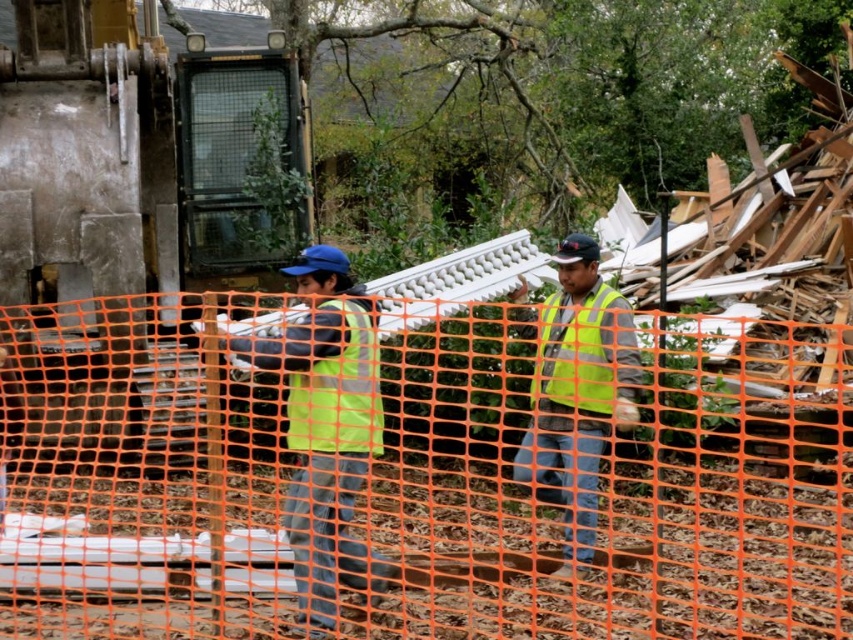
You are standing at the construction site and want to determine which of the two points, point (355,371) or point (556,292), is nearer to your current position. Based on the image, which point is closer?

Point (355,371) is closer to the camera than point (556,292), so it is the closer point.